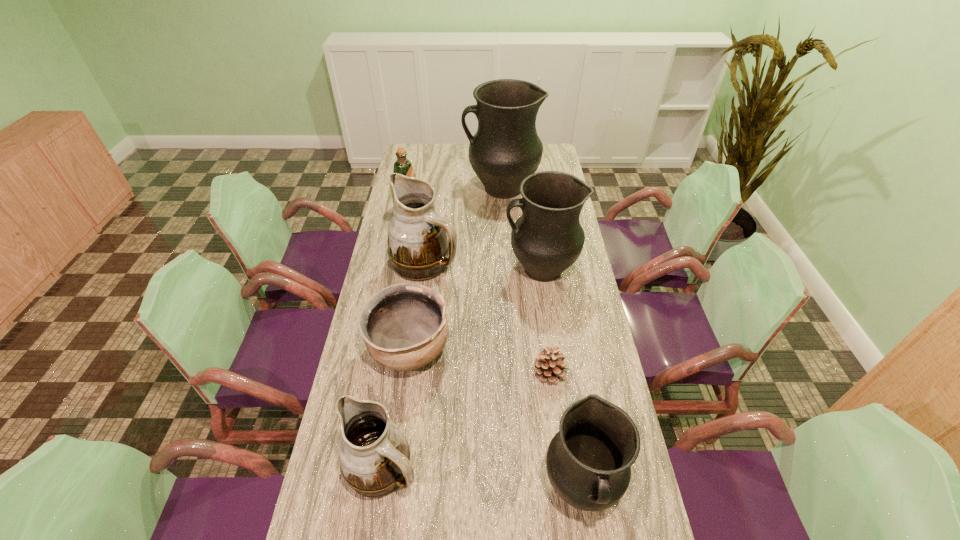
Where is `vacant area that lies between the farthest pitcher and the farther brown pitcher`? vacant area that lies between the farthest pitcher and the farther brown pitcher is located at coordinates (463, 226).

Where is `free space that is in between the bigger brown pitcher and the second nearest black pitcher`? Image resolution: width=960 pixels, height=540 pixels. free space that is in between the bigger brown pitcher and the second nearest black pitcher is located at coordinates (483, 266).

This screenshot has width=960, height=540. Identify the location of free space between the brown pinecone and the bigger brown pitcher. (488, 318).

This screenshot has height=540, width=960. Identify the location of object that stands as the closest to the tallest pitcher. (403, 166).

Where is `object identified as the closest to the shortest object`? object identified as the closest to the shortest object is located at coordinates (588, 462).

This screenshot has height=540, width=960. In order to click on pitcher that is the fifth closest to the olive oil in this screenshot , I will do `click(588, 462)`.

Image resolution: width=960 pixels, height=540 pixels. Identify the location of pitcher that is the fourth closest to the second biggest black pitcher. (374, 455).

I want to click on the third closest black pitcher to the nearer brown pitcher, so click(x=506, y=148).

Identify which black pitcher is the nearest to the smallest black pitcher. Please provide its 2D coordinates. Your answer should be formatted as a tuple, i.e. [(x, y)], where the tuple contains the x and y coordinates of a point satisfying the conditions above.

[(547, 239)]

You are a GUI agent. You are given a task and a screenshot of the screen. Output one action in this format:
    pyautogui.click(x=<x>, y=<y>)
    Task: Click on the vacant space that satisfies the following two spatial constraints: 1. from the spout of the farther brown pitcher; 2. on the left side of the shortest object
    The width and height of the screenshot is (960, 540).
    Given the screenshot: What is the action you would take?
    pyautogui.click(x=411, y=373)